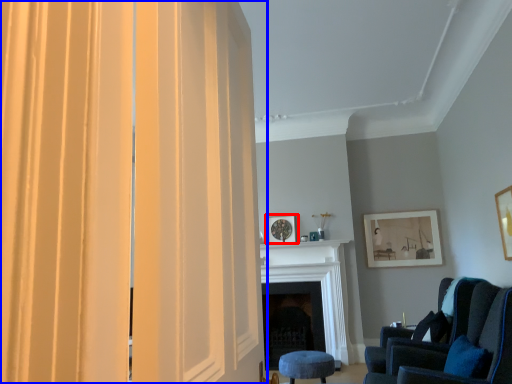
Question: Which object is closer to the camera taking this photo, picture frame (highlighted by a red box) or curtain (highlighted by a blue box)?

Choices:
 (A) picture frame
 (B) curtain

Answer: (B)